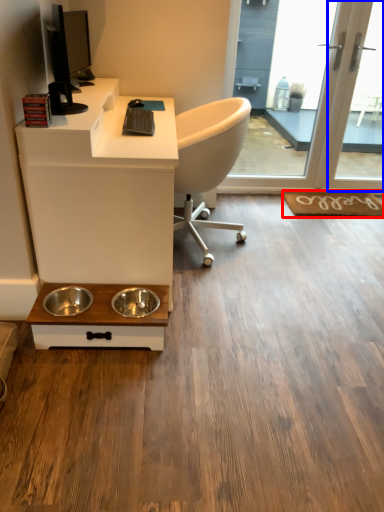
Question: Which of the following is the closest to the observer, doormat (highlighted by a red box) or screen door (highlighted by a blue box)?

Choices:
 (A) doormat
 (B) screen door

Answer: (B)